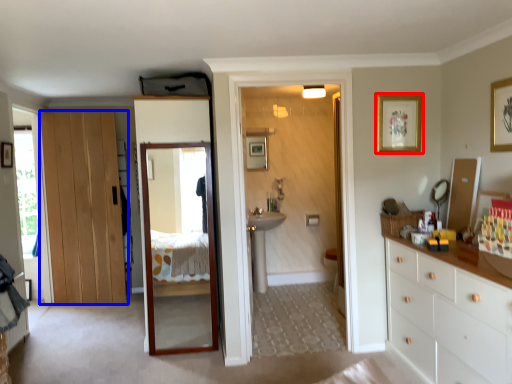
Question: Among these objects, which one is farthest to the camera, picture frame (highlighted by a red box) or door (highlighted by a blue box)?

Choices:
 (A) picture frame
 (B) door

Answer: (B)